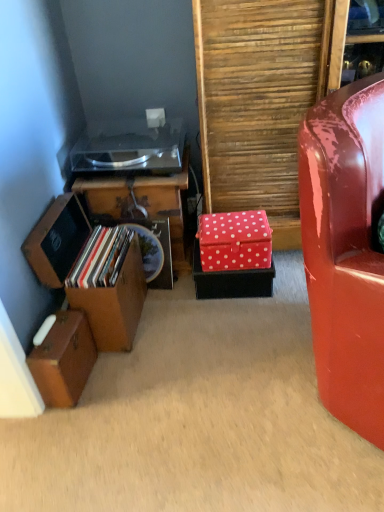
The height and width of the screenshot is (512, 384). I want to click on glossy red chair at right, so click(346, 250).

Measure the distance between wooden suitcase at lower left, marked as the first storage box in a left-to-right arrangement, and camera.

wooden suitcase at lower left, marked as the first storage box in a left-to-right arrangement, and camera are 4.05 feet apart.

What do you see at coordinates (257, 97) in the screenshot? I see `red polka dot box at center right` at bounding box center [257, 97].

Identify the location of wooden cabinet at left. The image size is (384, 512). (142, 204).

Where is `glossy red chair at right`? glossy red chair at right is located at coordinates (346, 250).

What's the angular difference between glossy red chair at right and wooden suitcase at lower left, placed as the third storage box when sorted from right to left,'s facing directions?

37.9 degrees.

Based on the photo, which of these two, glossy red chair at right or wooden suitcase at lower left, placed as the third storage box when sorted from right to left, is thinner?

With smaller width is wooden suitcase at lower left, placed as the third storage box when sorted from right to left.

From a real-world perspective, between glossy red chair at right and wooden suitcase at lower left, placed as the third storage box when sorted from right to left, who is vertically lower?

wooden suitcase at lower left, placed as the third storage box when sorted from right to left, is physically lower.

From the image's perspective, which is above, glossy red chair at right or wooden suitcase at lower left, marked as the first storage box in a left-to-right arrangement?

From the image's view, glossy red chair at right is above.

Can you tell me how much red polka dot fabric box at center, positioned as the 3th storage box in left-to-right order, and wooden storage box at left, positioned as the second storage box in right-to-left order, differ in facing direction?

84.8 degrees separate the facing orientations of red polka dot fabric box at center, positioned as the 3th storage box in left-to-right order, and wooden storage box at left, positioned as the second storage box in right-to-left order.

Based on the photo, would you say red polka dot fabric box at center, which ranks as the 1th storage box in right-to-left order, is outside wooden storage box at left, positioned as the second storage box in right-to-left order?

Yes.

Would you say red polka dot fabric box at center, which ranks as the 1th storage box in right-to-left order, is a long distance from wooden storage box at left, positioned as the second storage box in right-to-left order?

red polka dot fabric box at center, which ranks as the 1th storage box in right-to-left order, is actually quite close to wooden storage box at left, positioned as the second storage box in right-to-left order.

Is wooden storage box at left, positioned as the second storage box in right-to-left order, at the back of red polka dot fabric box at center, which ranks as the 1th storage box in right-to-left order?

No, red polka dot fabric box at center, which ranks as the 1th storage box in right-to-left order,'s orientation is not away from wooden storage box at left, positioned as the second storage box in right-to-left order.

From the image's perspective, is wooden cabinet at left located above or below red polka dot box at center right?

Clearly, from the image's perspective, wooden cabinet at left is below red polka dot box at center right.

Can you confirm if wooden cabinet at left is shorter than red polka dot box at center right?

Indeed, wooden cabinet at left has a lesser height compared to red polka dot box at center right.

Where is `furniture behind the red polka dot box at center right`? furniture behind the red polka dot box at center right is located at coordinates (142, 204).

Is wooden cabinet at left oriented away from red polka dot box at center right?

No, wooden cabinet at left is not facing the opposite direction of red polka dot box at center right.

Are red polka dot box at center right and red polka dot fabric box at center, which ranks as the 1th storage box in right-to-left order, making contact?

No, red polka dot box at center right is not with red polka dot fabric box at center, which ranks as the 1th storage box in right-to-left order.

Identify the location of the 2nd storage box behind when counting from the red polka dot box at center right. (235, 241).

Between red polka dot box at center right and red polka dot fabric box at center, positioned as the 3th storage box in left-to-right order, which one appears on the left side from the viewer's perspective?

From the viewer's perspective, red polka dot fabric box at center, positioned as the 3th storage box in left-to-right order, appears more on the left side.

Considering the sizes of objects red polka dot box at center right and red polka dot fabric box at center, which ranks as the 1th storage box in right-to-left order, in the image provided, who is wider, red polka dot box at center right or red polka dot fabric box at center, which ranks as the 1th storage box in right-to-left order,?

red polka dot box at center right.

From the image's perspective, is red polka dot fabric box at center, which ranks as the 1th storage box in right-to-left order, below wooden cabinet at left?

Correct, red polka dot fabric box at center, which ranks as the 1th storage box in right-to-left order, appears lower than wooden cabinet at left in the image.

Does red polka dot fabric box at center, positioned as the 3th storage box in left-to-right order, contain wooden cabinet at left?

No, wooden cabinet at left is located outside of red polka dot fabric box at center, positioned as the 3th storage box in left-to-right order.

Can you tell me how much red polka dot fabric box at center, which ranks as the 1th storage box in right-to-left order, and wooden cabinet at left differ in facing direction?

There is a 1.79-degree angle between the facing directions of red polka dot fabric box at center, which ranks as the 1th storage box in right-to-left order, and wooden cabinet at left.

How distant is red polka dot fabric box at center, which ranks as the 1th storage box in right-to-left order, from wooden cabinet at left?

red polka dot fabric box at center, which ranks as the 1th storage box in right-to-left order, is 10.06 inches from wooden cabinet at left.

Can you confirm if glossy red chair at right is positioned to the right of red polka dot box at center right?

Yes.

Which object is more forward, glossy red chair at right or red polka dot box at center right?

glossy red chair at right is in front.

Considering the sizes of objects glossy red chair at right and red polka dot box at center right in the image provided, who is shorter, glossy red chair at right or red polka dot box at center right?

Standing shorter between the two is glossy red chair at right.

Is glossy red chair at right not near red polka dot box at center right?

They are positioned close to each other.

Is glossy red chair at right far from wooden cabinet at left?

That's not correct — glossy red chair at right is a little close to wooden cabinet at left.

Would you say glossy red chair at right is to the left or to the right of wooden cabinet at left in the picture?

glossy red chair at right is to the right of wooden cabinet at left.

Is glossy red chair at right oriented away from wooden cabinet at left?

Yes.

Between glossy red chair at right and wooden cabinet at left, which one has larger size?

glossy red chair at right.

You are a GUI agent. You are given a task and a screenshot of the screen. Output one action in this format:
    pyautogui.click(x=<x>, y=<y>)
    Task: Click on the chair lying above the wooden suitcase at lower left, marked as the first storage box in a left-to-right arrangement (from the image's perspective)
    The image size is (384, 512).
    Given the screenshot: What is the action you would take?
    pyautogui.click(x=346, y=250)

Where is `storage box that appears behind the wooden storage box at left, the second storage box in the left-to-right sequence`? This screenshot has height=512, width=384. storage box that appears behind the wooden storage box at left, the second storage box in the left-to-right sequence is located at coordinates (235, 241).

Consider the image. Which object lies nearer to the anchor point red polka dot fabric box at center, which ranks as the 1th storage box in right-to-left order, glossy red chair at right or wooden storage box at left, positioned as the second storage box in right-to-left order?

wooden storage box at left, positioned as the second storage box in right-to-left order.

From the image, which object appears to be farther from wooden cabinet at left, wooden suitcase at lower left, marked as the first storage box in a left-to-right arrangement, or wooden storage box at left, positioned as the second storage box in right-to-left order?

The object further to wooden cabinet at left is wooden suitcase at lower left, marked as the first storage box in a left-to-right arrangement.

Considering their positions, is red polka dot fabric box at center, positioned as the 3th storage box in left-to-right order, positioned further to glossy red chair at right than red polka dot box at center right?

red polka dot box at center right is positioned further to the anchor glossy red chair at right.

When comparing their distances from wooden cabinet at left, does red polka dot box at center right or glossy red chair at right seem further?

Based on the image, glossy red chair at right appears to be further to wooden cabinet at left.

Looking at the image, which one is located further to red polka dot box at center right, wooden suitcase at lower left, placed as the third storage box when sorted from right to left, or red polka dot fabric box at center, which ranks as the 1th storage box in right-to-left order?

wooden suitcase at lower left, placed as the third storage box when sorted from right to left, is positioned further to the anchor red polka dot box at center right.

Based on the photo, from the image, which object appears to be nearer to red polka dot fabric box at center, which ranks as the 1th storage box in right-to-left order, wooden storage box at left, the second storage box in the left-to-right sequence, or glossy red chair at right?

wooden storage box at left, the second storage box in the left-to-right sequence, is positioned closer to the anchor red polka dot fabric box at center, which ranks as the 1th storage box in right-to-left order.

Estimate the real-world distances between objects in this image. Which object is further from red polka dot box at center right, wooden cabinet at left or wooden storage box at left, the second storage box in the left-to-right sequence?

wooden storage box at left, the second storage box in the left-to-right sequence, lies further to red polka dot box at center right than the other object.

Considering their positions, is glossy red chair at right positioned further to wooden suitcase at lower left, marked as the first storage box in a left-to-right arrangement, than red polka dot fabric box at center, positioned as the 3th storage box in left-to-right order?

The object further to wooden suitcase at lower left, marked as the first storage box in a left-to-right arrangement, is glossy red chair at right.

Locate an element on the screen. storage box situated between wooden cabinet at left and red polka dot box at center right from left to right is located at coordinates (235, 241).

The height and width of the screenshot is (512, 384). Find the location of `plywood located between glossy red chair at right and red polka dot fabric box at center, positioned as the 3th storage box in left-to-right order, in the depth direction`. plywood located between glossy red chair at right and red polka dot fabric box at center, positioned as the 3th storage box in left-to-right order, in the depth direction is located at coordinates (257, 97).

Identify the location of plywood between glossy red chair at right and wooden cabinet at left from front to back. (257, 97).

I want to click on furniture between wooden suitcase at lower left, placed as the third storage box when sorted from right to left, and glossy red chair at right from left to right, so click(x=142, y=204).